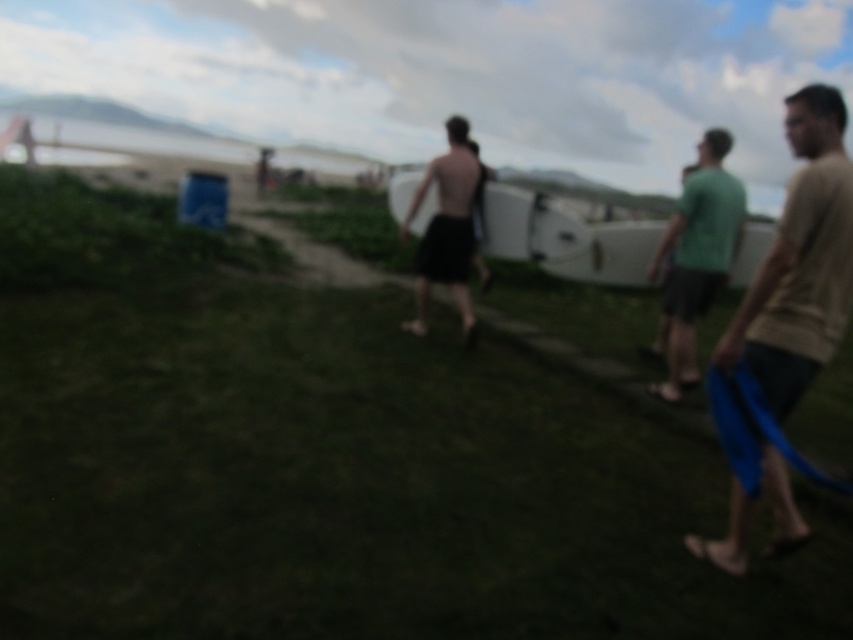
You are standing in the coastal area and see the green grassy at center and the tan fabric shorts at right. Which object is closer to you?

The green grassy at center is closer to you because it is further to the viewer than the tan fabric shorts at right.

You are a photographer trying to capture the scene. You notice the tan fabric shorts at right and the black matte surfboard at center. Which object is positioned lower in the image?

The tan fabric shorts at right is below the black matte surfboard at center, so the tan fabric shorts at right is positioned lower in the image.

You are standing at the center of the image. Which direction should you move to reach the green grassy at center?

The green grassy at center is located at point coordinates of (329,460). Since you are already at the center, you are already standing on the green grassy at center.